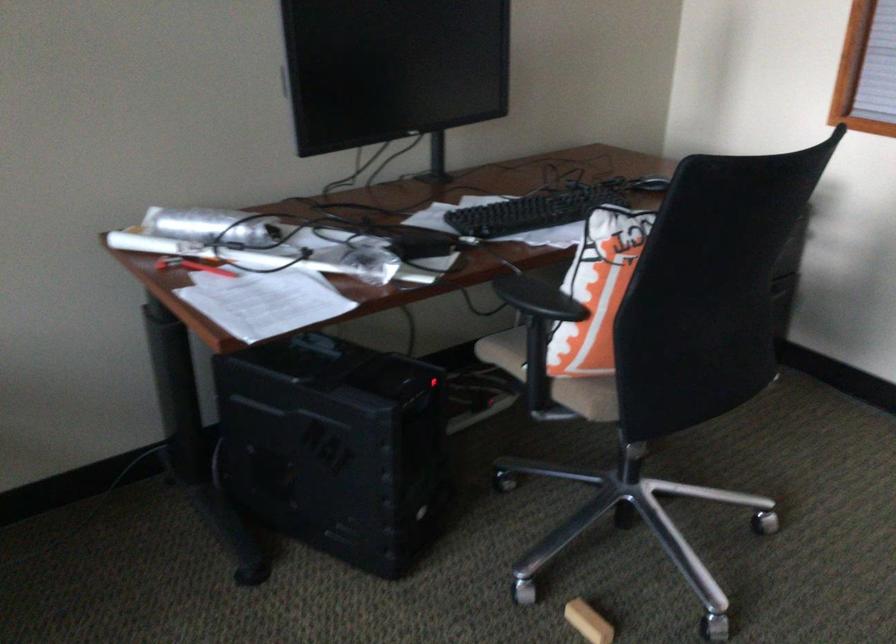
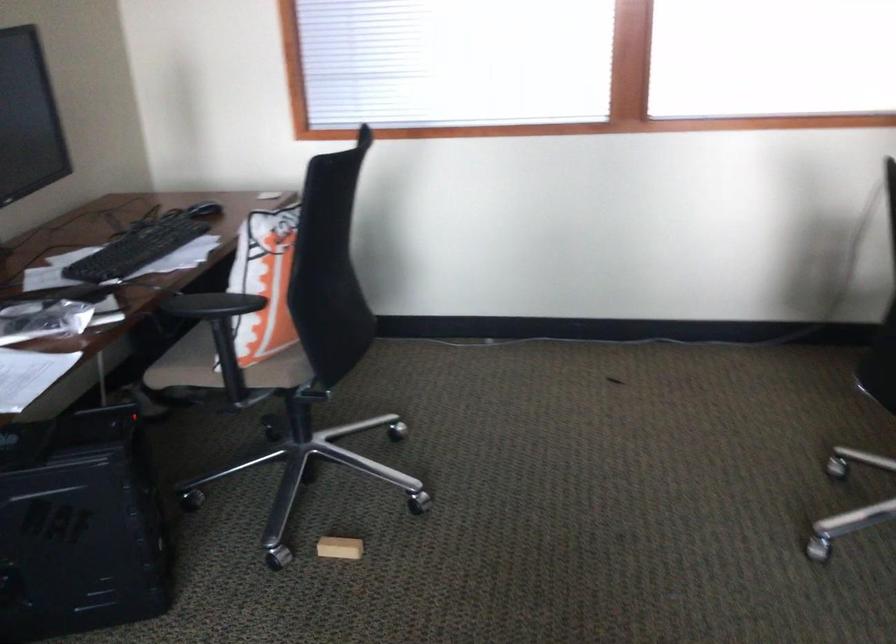
Locate, in the second image, the point that corresponds to point (641, 183) in the first image.

(204, 210)